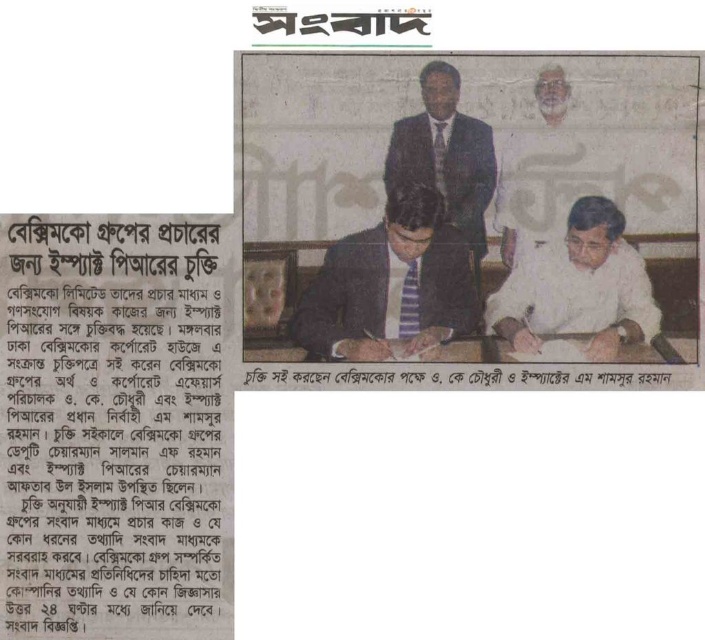
Is matte black suit at center below white matte shirt at center?

Yes.

Does matte black suit at center appear over white matte shirt at center?

Actually, matte black suit at center is below white matte shirt at center.

Locate an element on the screen. matte black suit at center is located at coordinates (391, 285).

This screenshot has width=705, height=640. What are the coordinates of `matte black suit at center` in the screenshot? It's located at (391, 285).

Can you confirm if matte black suit at center is thinner than dark blue suit at center?

No.

Does matte black suit at center have a lesser height compared to dark blue suit at center?

Yes, matte black suit at center is shorter than dark blue suit at center.

Looking at this image, measure the distance between matte black suit at center and camera.

matte black suit at center is 1.06 meters away from camera.

Find the location of a particular element. This screenshot has height=640, width=705. matte black suit at center is located at coordinates [x=391, y=285].

Does white paper text at upper left have a lesser width compared to dark blue suit at center?

In fact, white paper text at upper left might be wider than dark blue suit at center.

Is white paper text at upper left positioned at the back of dark blue suit at center?

No, white paper text at upper left is in front of dark blue suit at center.

Locate an element on the screen. The height and width of the screenshot is (640, 705). white paper text at upper left is located at coordinates (114, 428).

Locate an element on the screen. white paper text at upper left is located at coordinates (114, 428).